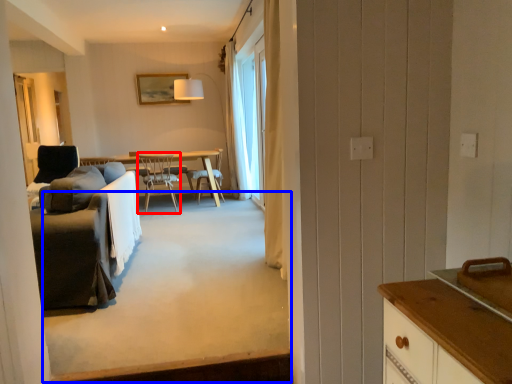
Question: Which object is closer to the camera taking this photo, chair (highlighted by a red box) or plain (highlighted by a blue box)?

Choices:
 (A) chair
 (B) plain

Answer: (B)